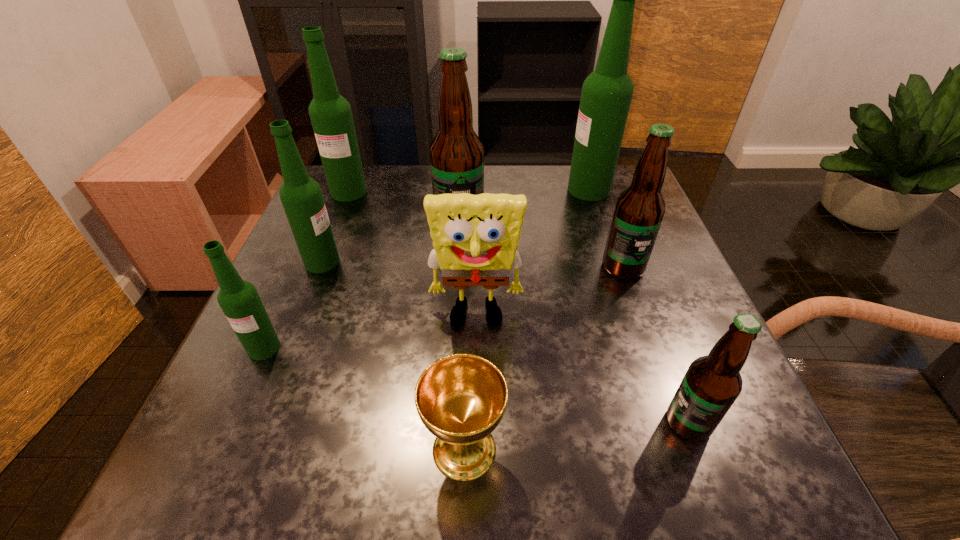
Find the location of a particular element. The width and height of the screenshot is (960, 540). the tallest object is located at coordinates (606, 95).

Identify the location of the tallest beer bottle. (606, 95).

Where is `the second biggest green beer bottle`? The height and width of the screenshot is (540, 960). the second biggest green beer bottle is located at coordinates (331, 116).

Locate an element on the screen. This screenshot has height=540, width=960. the seventh nearest object is located at coordinates (456, 153).

You are a GUI agent. You are given a task and a screenshot of the screen. Output one action in this format:
    pyautogui.click(x=<x>, y=<y>)
    Task: Click on the farthest brown beer bottle
    The width and height of the screenshot is (960, 540).
    Given the screenshot: What is the action you would take?
    pyautogui.click(x=456, y=153)

I want to click on the second smallest green beer bottle, so click(x=301, y=196).

The width and height of the screenshot is (960, 540). I want to click on the second farthest brown beer bottle, so click(x=639, y=210).

What are the coordinates of `the sixth farthest object` in the screenshot? It's located at (475, 237).

Image resolution: width=960 pixels, height=540 pixels. Identify the location of the nearest brown beer bottle. (712, 383).

Where is `the nearest beer bottle`? The width and height of the screenshot is (960, 540). the nearest beer bottle is located at coordinates (712, 383).